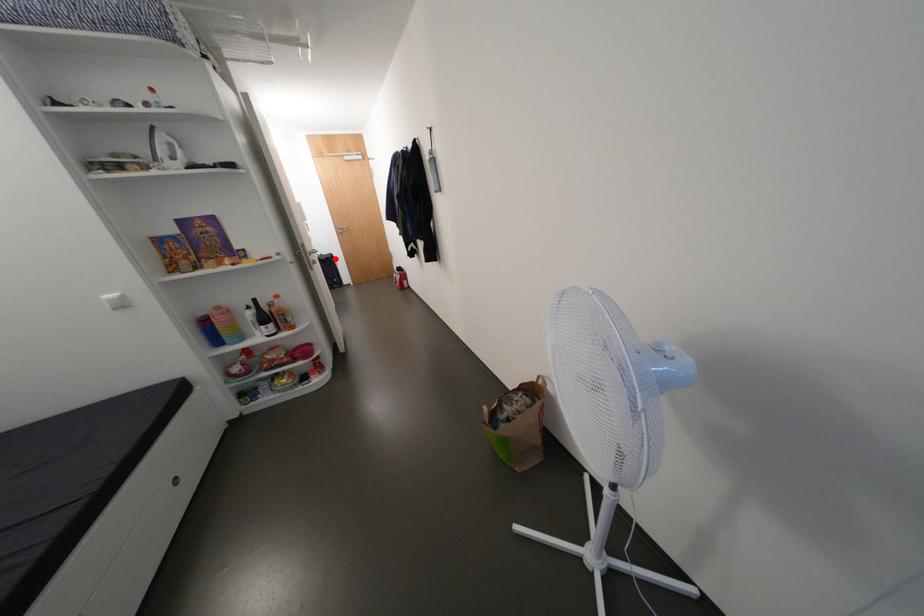
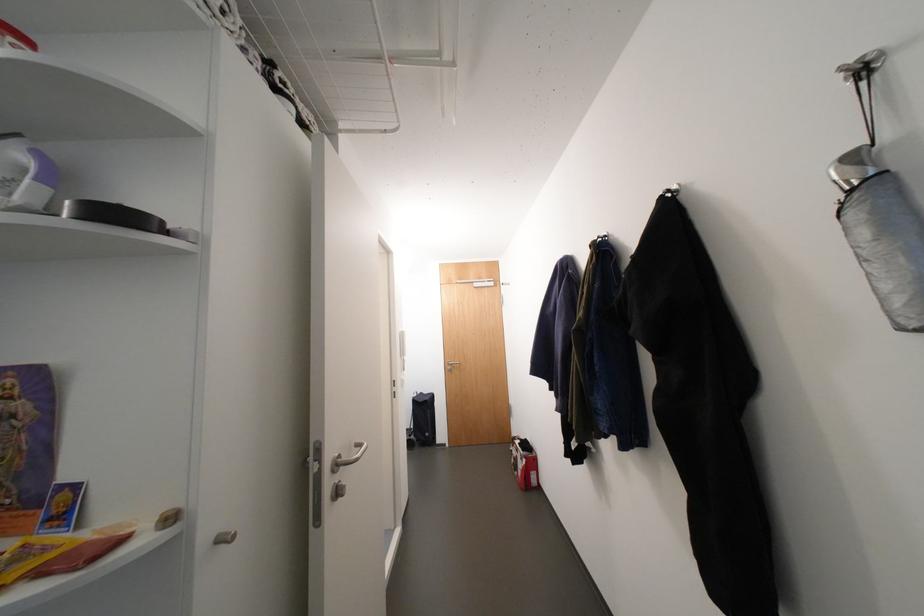
Locate, in the second image, the point that corresponds to the highlighted location in the first image.

(433, 402)